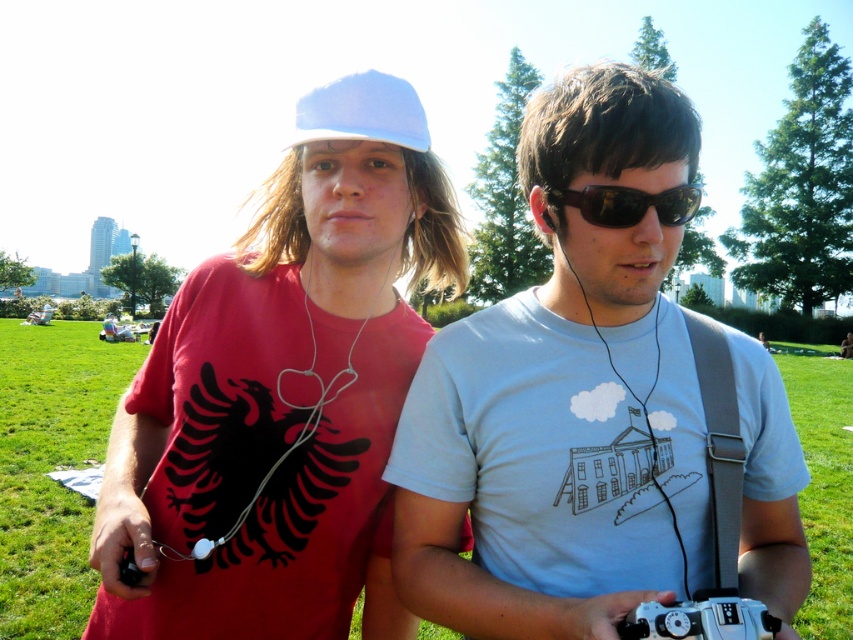
Question: Which point is closer to the camera taking this photo?

Choices:
 (A) (363, 387)
 (B) (648, 624)
 (C) (399, 84)
 (D) (618, 227)

Answer: (B)

Question: Considering the relative positions of white plastic camera at center and sunglasses at center in the image provided, where is white plastic camera at center located with respect to sunglasses at center?

Choices:
 (A) right
 (B) left

Answer: (A)

Question: Among these objects, which one is nearest to the camera?

Choices:
 (A) light blue fabric baseball cap at upper center
 (B) sunglasses at center
 (C) white plastic camera at center
 (D) matte red t-shirt at center

Answer: (C)

Question: Does white matte t-shirt at center appear under light blue fabric baseball cap at upper center?

Choices:
 (A) no
 (B) yes

Answer: (B)

Question: Considering the relative positions of sunglasses at center and white earphone at center in the image provided, where is sunglasses at center located with respect to white earphone at center?

Choices:
 (A) below
 (B) above

Answer: (A)

Question: Which point is closer to the camera taking this photo?

Choices:
 (A) (604, 216)
 (B) (415, 216)
 (C) (289, 163)
 (D) (656, 620)

Answer: (D)